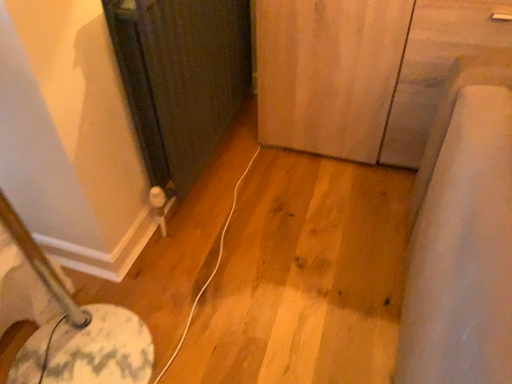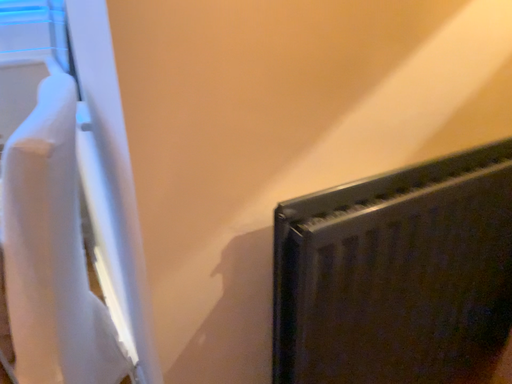
Question: Which way did the camera rotate in the video?

Choices:
 (A) rotated upward
 (B) rotated downward

Answer: (A)